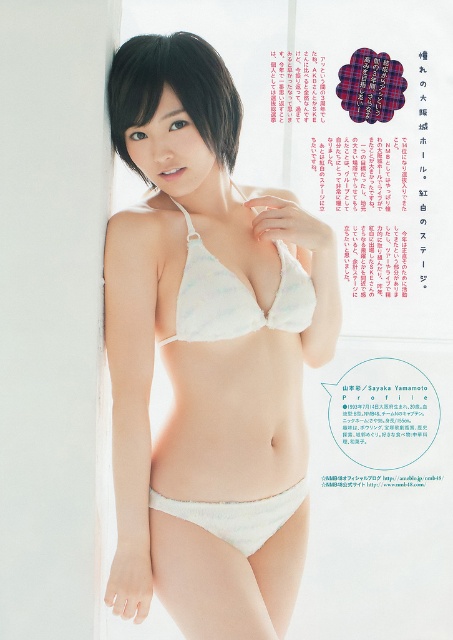
Question: Does white lace bikini top at center appear on the left side of white soft fabric underwear at lower center?

Choices:
 (A) yes
 (B) no

Answer: (B)

Question: Which object is the farthest from the white lace bikini at center?

Choices:
 (A) white matte lingerie at center
 (B) white lace bikini top at center
 (C) white soft fabric underwear at lower center
 (D) dark brown silky hair at upper center

Answer: (C)

Question: Can you confirm if dark brown silky hair at upper center is positioned above white soft fabric underwear at lower center?

Choices:
 (A) no
 (B) yes

Answer: (B)

Question: Is white lace bikini at center to the right of dark brown silky hair at upper center from the viewer's perspective?

Choices:
 (A) yes
 (B) no

Answer: (A)

Question: Among these objects, which one is nearest to the camera?

Choices:
 (A) dark brown silky hair at upper center
 (B) white lace bikini top at center
 (C) white lace bikini at center
 (D) white soft fabric underwear at lower center

Answer: (A)

Question: Among these objects, which one is farthest from the camera?

Choices:
 (A) dark brown silky hair at upper center
 (B) white lace bikini at center

Answer: (B)